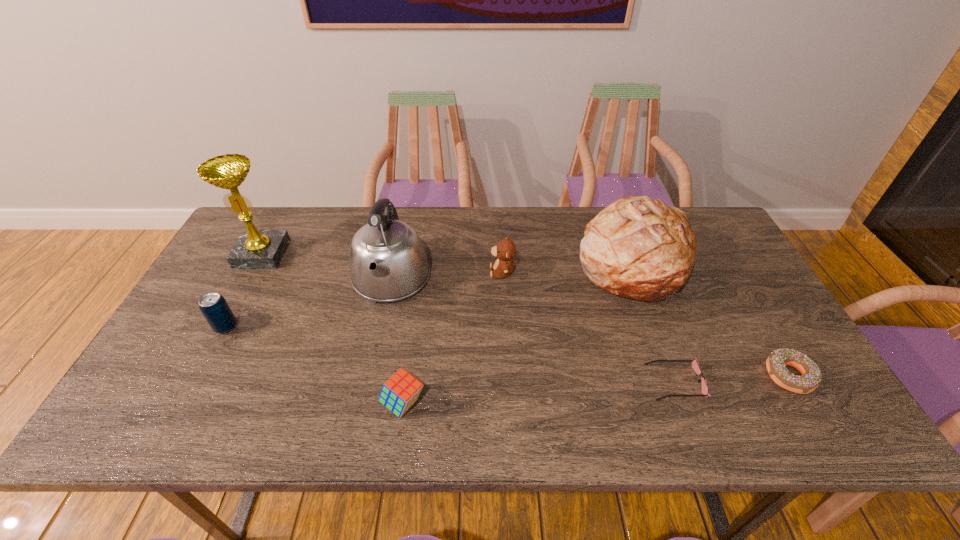
Find the location of a particular element. object at the far left corner is located at coordinates (255, 249).

Where is `object that is at the far right corner`? This screenshot has height=540, width=960. object that is at the far right corner is located at coordinates (639, 248).

In the image, there is a desktop. Identify the location of blank space at the far edge. The image size is (960, 540). (475, 215).

The width and height of the screenshot is (960, 540). In order to click on vacant space at the near edge of the desktop in this screenshot , I will do `click(300, 435)`.

You are a GUI agent. You are given a task and a screenshot of the screen. Output one action in this format:
    pyautogui.click(x=<x>, y=<y>)
    Task: Click on the vacant area at the left edge
    
    Given the screenshot: What is the action you would take?
    pyautogui.click(x=188, y=355)

I want to click on vacant space at the right edge of the desktop, so click(x=727, y=298).

In the image, there is a desktop. Identify the location of vacant space at the near left corner. The height and width of the screenshot is (540, 960). (164, 406).

You are a GUI agent. You are given a task and a screenshot of the screen. Output one action in this format:
    pyautogui.click(x=<x>, y=<y>)
    Task: Click on the vacant space at the far right corner of the desktop
    The width and height of the screenshot is (960, 540).
    Given the screenshot: What is the action you would take?
    pyautogui.click(x=714, y=245)

At what (x,y) coordinates should I click in order to perform the action: click on vacant area that lies between the shortest object and the award. Please return your answer as a coordinate pair (x, y). This screenshot has height=540, width=960. Looking at the image, I should click on (468, 318).

In order to click on empty space between the cube and the tallest object in this screenshot , I will do click(x=333, y=329).